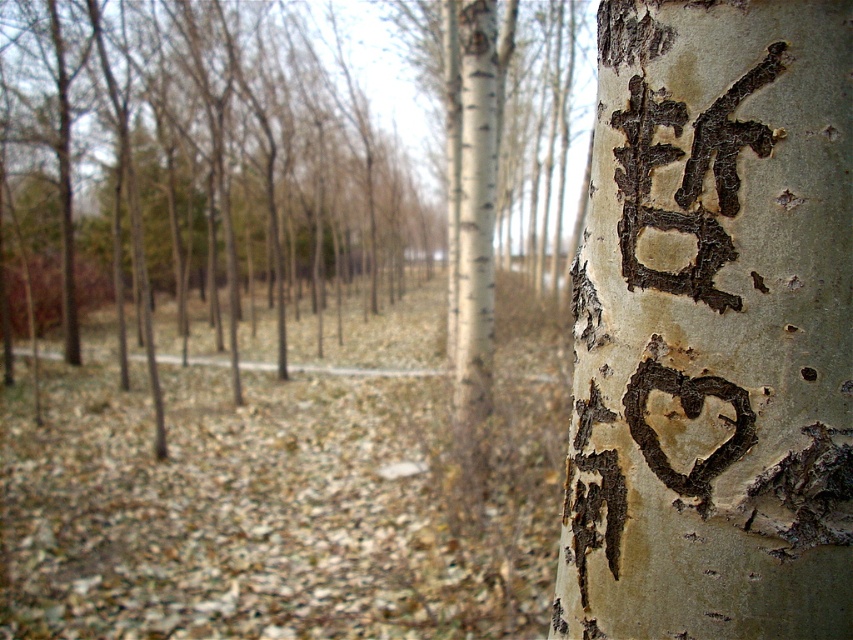
Does smooth white bark at center appear under black bark writing at upper right?

Correct, smooth white bark at center is located below black bark writing at upper right.

Is point (849, 164) positioned before point (746, 80)?

Yes, point (849, 164) is closer to viewer.

Where is `smooth white bark at center`? This screenshot has height=640, width=853. smooth white bark at center is located at coordinates (712, 328).